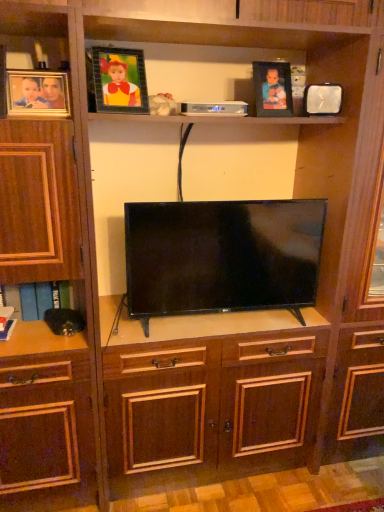
Question: Is flat screen tv at center positioned behind matte wooden picture frame at upper left, which ranks as the first picture frame in left-to-right order?

Choices:
 (A) yes
 (B) no

Answer: (A)

Question: From a real-world perspective, is flat screen tv at center over matte wooden picture frame at upper left, which appears as the 4th picture frame when viewed from the right?

Choices:
 (A) no
 (B) yes

Answer: (A)

Question: From the image's perspective, would you say flat screen tv at center is shown under matte wooden picture frame at upper left, which ranks as the first picture frame in left-to-right order?

Choices:
 (A) no
 (B) yes

Answer: (B)

Question: Can you confirm if flat screen tv at center is bigger than matte wooden picture frame at upper left, which appears as the 4th picture frame when viewed from the right?

Choices:
 (A) yes
 (B) no

Answer: (A)

Question: Does flat screen tv at center appear on the right side of matte wooden picture frame at upper left, which appears as the 4th picture frame when viewed from the right?

Choices:
 (A) no
 (B) yes

Answer: (B)

Question: In the image, is metallic frame at upper center, the second picture frame positioned from the left, positioned in front of or behind flat screen tv at center?

Choices:
 (A) front
 (B) behind

Answer: (A)

Question: From the image's perspective, is metallic frame at upper center, the second picture frame positioned from the left, located above or below flat screen tv at center?

Choices:
 (A) above
 (B) below

Answer: (A)

Question: In terms of height, does metallic frame at upper center, the second picture frame positioned from the left, look taller or shorter compared to flat screen tv at center?

Choices:
 (A) short
 (B) tall

Answer: (A)

Question: Does point (109, 106) appear closer or farther from the camera than point (190, 209)?

Choices:
 (A) farther
 (B) closer

Answer: (B)

Question: Looking at their shapes, would you say matte black picture frame at upper center, the third picture frame positioned from the left, is wider or thinner than matte wooden picture frame at upper left, which ranks as the first picture frame in left-to-right order?

Choices:
 (A) thin
 (B) wide

Answer: (B)

Question: From the image's perspective, is matte black picture frame at upper center, the second picture frame in the right-to-left sequence, located above or below matte wooden picture frame at upper left, which ranks as the first picture frame in left-to-right order?

Choices:
 (A) above
 (B) below

Answer: (A)

Question: Is point 281,77 closer or farther from the camera than point 59,81?

Choices:
 (A) farther
 (B) closer

Answer: (A)

Question: In terms of size, does matte black picture frame at upper center, the third picture frame positioned from the left, appear bigger or smaller than matte wooden picture frame at upper left, which appears as the 4th picture frame when viewed from the right?

Choices:
 (A) big
 (B) small

Answer: (A)

Question: Is point (324, 96) positioned closer to the camera than point (59, 116)?

Choices:
 (A) closer
 (B) farther

Answer: (B)

Question: In terms of height, does metallic silver clock at upper right, which is counted as the fourth picture frame, starting from the left, look taller or shorter compared to matte wooden picture frame at upper left, which appears as the 4th picture frame when viewed from the right?

Choices:
 (A) tall
 (B) short

Answer: (B)